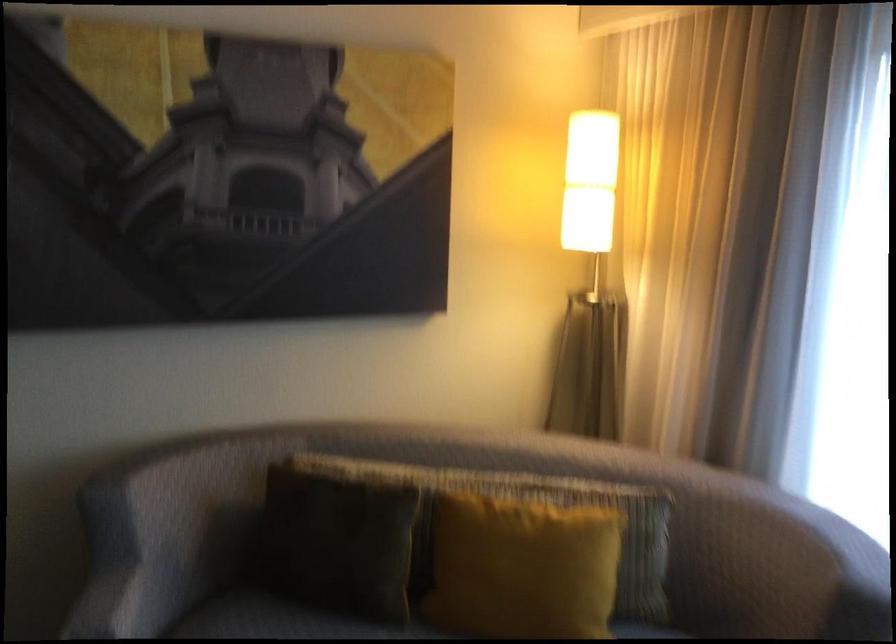
What do you see at coordinates (119, 569) in the screenshot? I see `the sofa armrest` at bounding box center [119, 569].